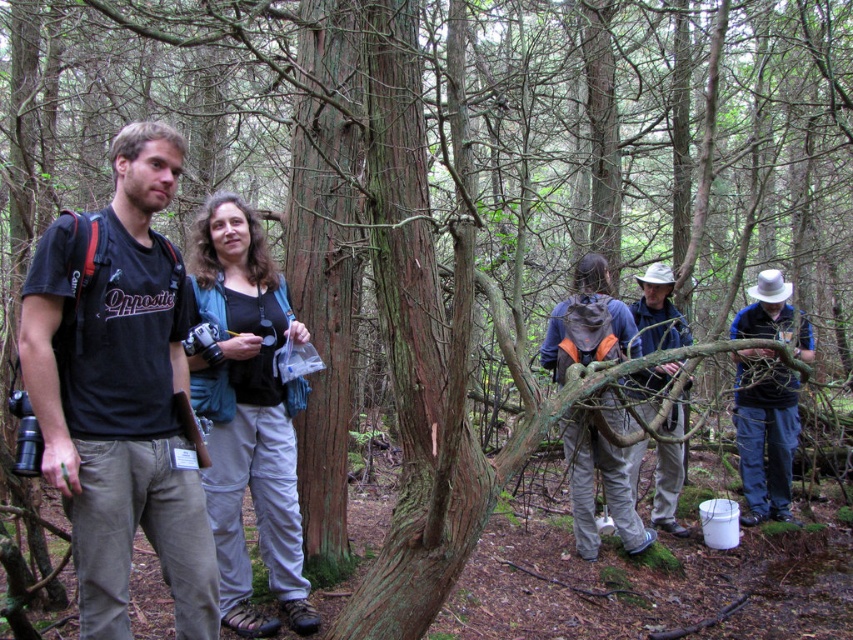
Question: Which point is closer to the camera?

Choices:
 (A) (639, 330)
 (B) (740, 380)
 (C) (283, 448)
 (D) (163, 573)

Answer: (D)

Question: Among these objects, which one is nearest to the camera?

Choices:
 (A) khaki cotton pants at center
 (B) matte black shirt at center
 (C) matte black t-shirt at left
 (D) blue fabric shirt at right

Answer: (C)

Question: Can you confirm if matte black t-shirt at left is wider than matte black shirt at center?

Choices:
 (A) yes
 (B) no

Answer: (B)

Question: Considering the real-world distances, which object is closest to the khaki cotton pants at center?

Choices:
 (A) matte black t-shirt at left
 (B) matte black shirt at center

Answer: (B)

Question: Is matte black t-shirt at left positioned before matte black shirt at center?

Choices:
 (A) yes
 (B) no

Answer: (A)

Question: Does matte black shirt at center have a larger size compared to blue fabric shirt at right?

Choices:
 (A) yes
 (B) no

Answer: (B)